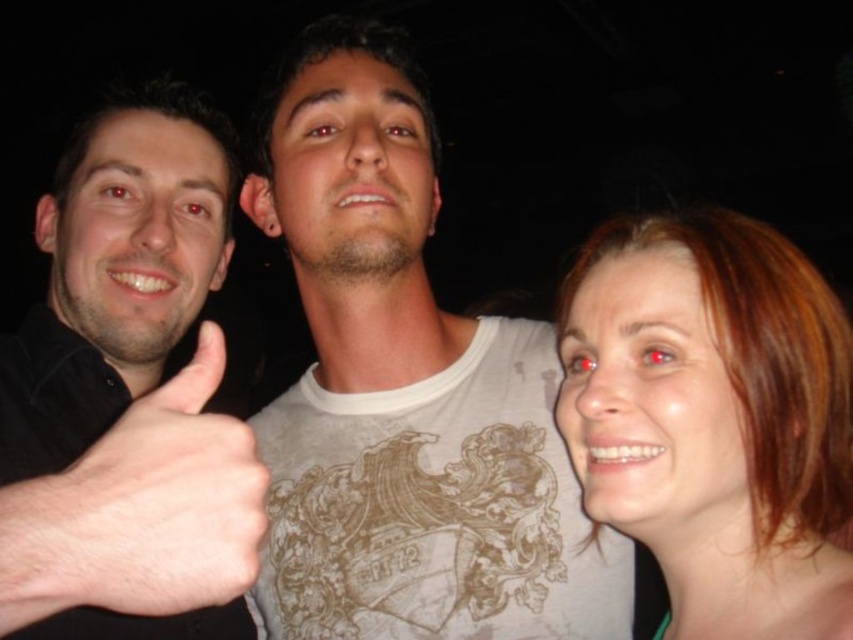
Question: Which point appears farthest from the camera in this image?

Choices:
 (A) (573, 589)
 (B) (251, 541)

Answer: (A)

Question: Is blonde hair at right to the left of skinny white hand at left from the viewer's perspective?

Choices:
 (A) no
 (B) yes

Answer: (A)

Question: Is blonde hair at right smaller than skinny white hand at left?

Choices:
 (A) no
 (B) yes

Answer: (A)

Question: Can you confirm if white matte t-shirt at center is positioned to the left of blonde hair at right?

Choices:
 (A) yes
 (B) no

Answer: (A)

Question: Which object is positioned closest to the blonde hair at right?

Choices:
 (A) skinny white hand at left
 (B) white matte t-shirt at center

Answer: (B)

Question: Among these objects, which one is nearest to the camera?

Choices:
 (A) white matte t-shirt at center
 (B) skinny white hand at left
 (C) blonde hair at right

Answer: (B)